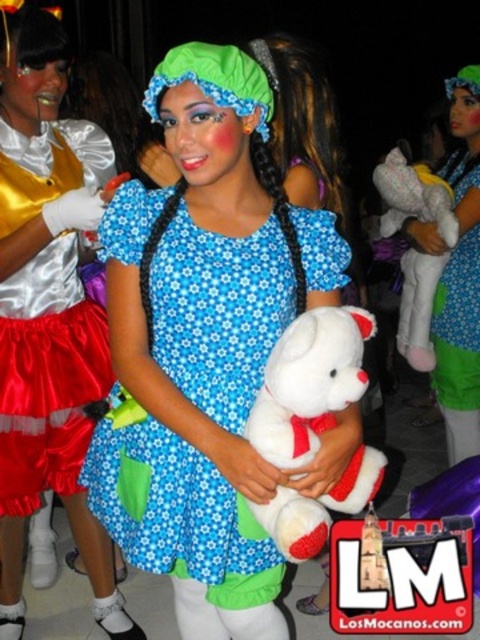
Between point (48, 433) and point (448, 272), which one is positioned in front?

Point (48, 433) is more forward.

Who is higher up, satin red skirt at left or matte blue dress at center?

matte blue dress at center is above.

This screenshot has width=480, height=640. I want to click on satin red skirt at left, so click(47, 376).

Can you confirm if satin red skirt at left is wider than white plush bear at center?

Incorrect, satin red skirt at left's width does not surpass white plush bear at center's.

Can you confirm if satin red skirt at left is positioned above white plush bear at center?

Yes, satin red skirt at left is above white plush bear at center.

Is point (75, 157) positioned after point (358, 496)?

Yes, point (75, 157) is behind point (358, 496).

Locate an element on the screen. This screenshot has height=640, width=480. satin red skirt at left is located at coordinates (47, 376).

Is white plush bear at center in front of matte blue dress at center?

That is True.

Is white plush bear at center shorter than matte blue dress at center?

Indeed, white plush bear at center has a lesser height compared to matte blue dress at center.

Between point (294, 403) and point (451, 312), which one is positioned behind?

Point (451, 312)

Find the location of a particular element. The height and width of the screenshot is (640, 480). white plush bear at center is located at coordinates (309, 381).